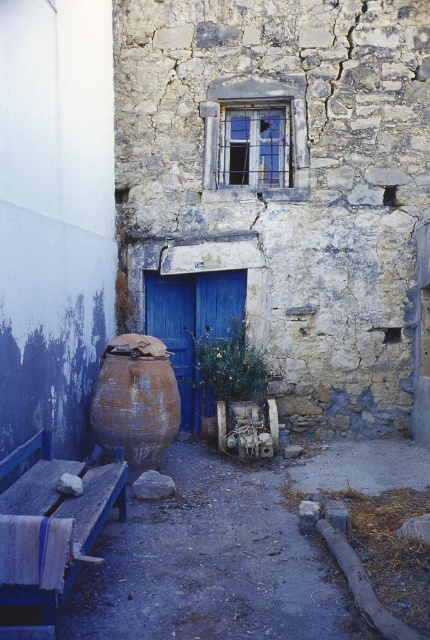
Can you confirm if blue painted wood bench at lower left is bigger than blue matte door at center?

Indeed, blue painted wood bench at lower left has a larger size compared to blue matte door at center.

Is point (45, 628) farther from viewer compared to point (149, 273)?

No.

Does point (12, 582) lie in front of point (223, 321)?

That is True.

Locate an element on the screen. Image resolution: width=430 pixels, height=640 pixels. blue painted wood bench at lower left is located at coordinates pyautogui.click(x=49, y=529).